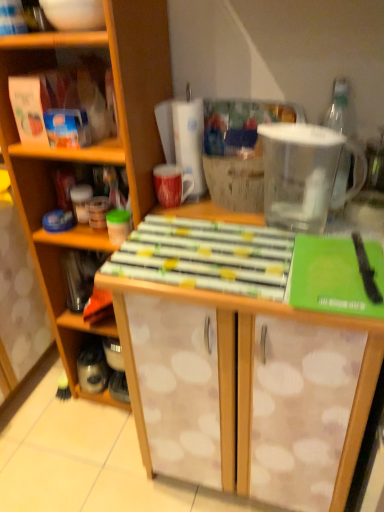
Identify the location of free space above transparent plastic pitcher at upper right (from a real-world perspective). This screenshot has width=384, height=512. (298, 129).